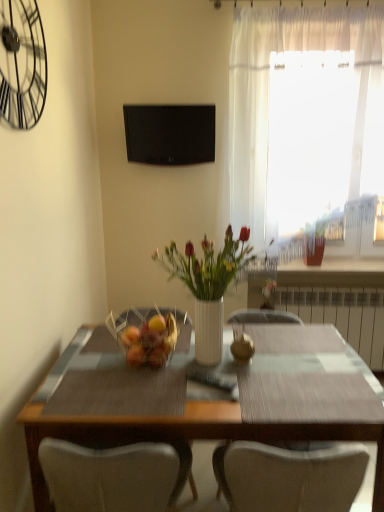
You are a GUI agent. You are given a task and a screenshot of the screen. Output one action in this format:
    pyautogui.click(x=<x>, y=<y>)
    Task: Click on the free space above white metallic radiator at right (from a real-world perspective)
    This screenshot has width=384, height=512.
    Given the screenshot: What is the action you would take?
    pyautogui.click(x=324, y=287)